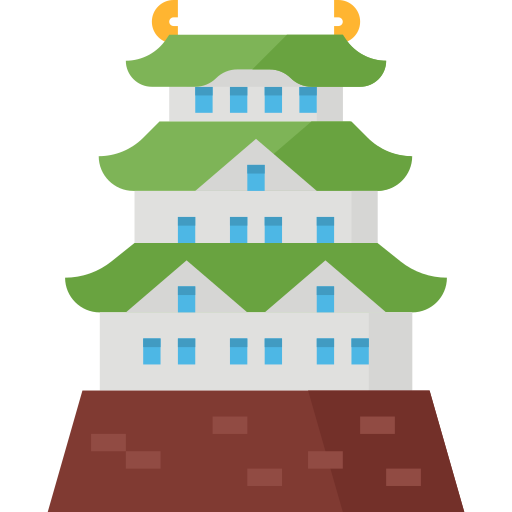
Identify the location of yellow decorations. (159, 20), (355, 14).